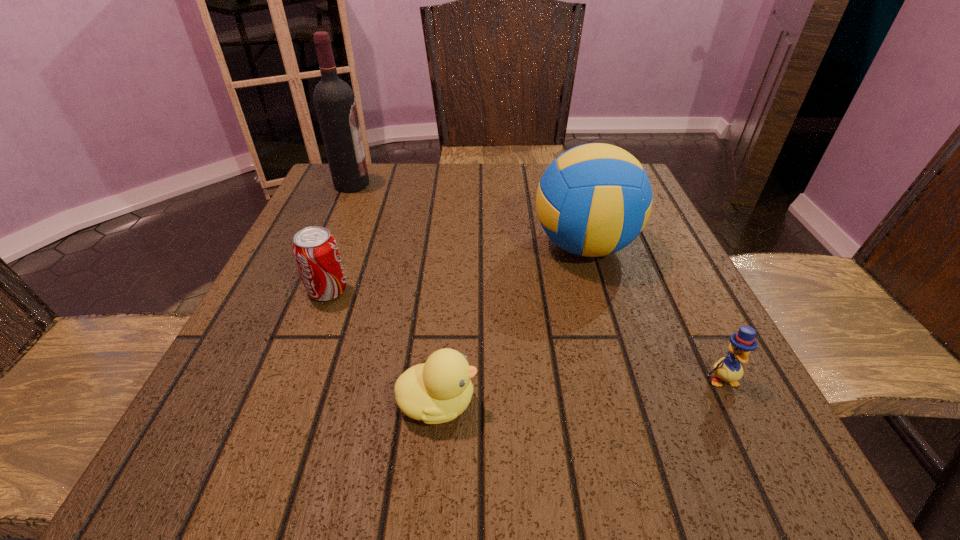
The image size is (960, 540). What are the coordinates of `the tallest object` in the screenshot? It's located at (334, 100).

You are a GUI agent. You are given a task and a screenshot of the screen. Output one action in this format:
    pyautogui.click(x=<x>, y=<y>)
    Task: Click on the farthest object
    
    Given the screenshot: What is the action you would take?
    pyautogui.click(x=334, y=100)

Where is `the second tallest object`? The height and width of the screenshot is (540, 960). the second tallest object is located at coordinates click(593, 200).

Locate an element on the screen. The height and width of the screenshot is (540, 960). volleyball is located at coordinates click(593, 200).

Locate an element on the screen. The width and height of the screenshot is (960, 540). soda is located at coordinates (316, 253).

Where is `the rightmost object`? The height and width of the screenshot is (540, 960). the rightmost object is located at coordinates (729, 369).

Where is `the left duckling`? the left duckling is located at coordinates (437, 391).

Find the location of a particular element. This screenshot has height=540, width=960. vacant area situated 0.290m on the label of the tallest object is located at coordinates (486, 185).

Locate an element on the screen. This screenshot has height=540, width=960. free space located on the left of the second object from right to left is located at coordinates (386, 246).

The width and height of the screenshot is (960, 540). Find the location of `free space located on the front of the soda`. free space located on the front of the soda is located at coordinates (294, 380).